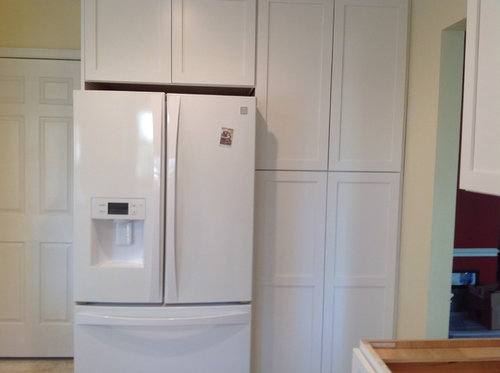
Image resolution: width=500 pixels, height=373 pixels. Find the location of `cabinets`. cabinets is located at coordinates (148, 47), (211, 46), (286, 61), (361, 67), (361, 231), (303, 237).